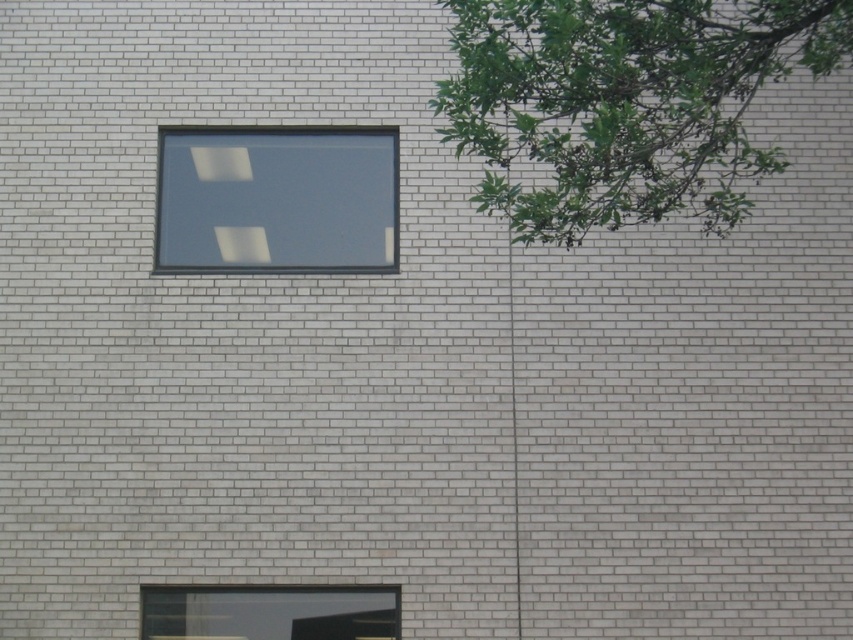
Question: Can you confirm if transparent glass window at upper center is positioned to the right of transparent glass window at lower center?

Choices:
 (A) no
 (B) yes

Answer: (A)

Question: Which of the following is the farthest from the observer?

Choices:
 (A) transparent glass window at lower center
 (B) transparent glass window at upper center

Answer: (B)

Question: Where is transparent glass window at upper center located in relation to transparent glass window at lower center in the image?

Choices:
 (A) left
 (B) right

Answer: (A)

Question: Among these objects, which one is farthest from the camera?

Choices:
 (A) transparent glass window at lower center
 (B) transparent glass window at upper center

Answer: (B)

Question: Is transparent glass window at upper center behind transparent glass window at lower center?

Choices:
 (A) no
 (B) yes

Answer: (B)